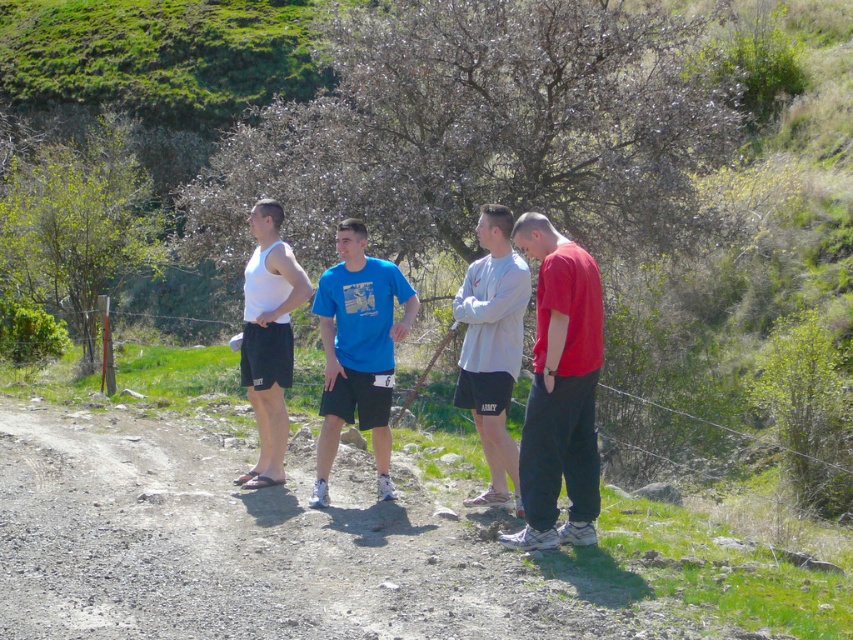
Question: Among these objects, which one is nearest to the camera?

Choices:
 (A) gray matte shorts at center
 (B) white matte tank top at center

Answer: (A)

Question: Is dirt track at center smaller than gray matte shorts at center?

Choices:
 (A) yes
 (B) no

Answer: (A)

Question: Estimate the real-world distances between objects in this image. Which object is closer to the gray matte shorts at center?

Choices:
 (A) blue cotton t-shirt at center
 (B) matte red shirt at center
 (C) white matte tank top at center
 (D) dirt track at center

Answer: (B)

Question: Can you confirm if dirt track at center is thinner than white matte tank top at center?

Choices:
 (A) yes
 (B) no

Answer: (B)

Question: In this image, where is matte red shirt at center located relative to blue cotton t-shirt at center?

Choices:
 (A) left
 (B) right

Answer: (B)

Question: Among these objects, which one is farthest from the camera?

Choices:
 (A) gray matte shorts at center
 (B) matte red shirt at center
 (C) dirt track at center

Answer: (A)